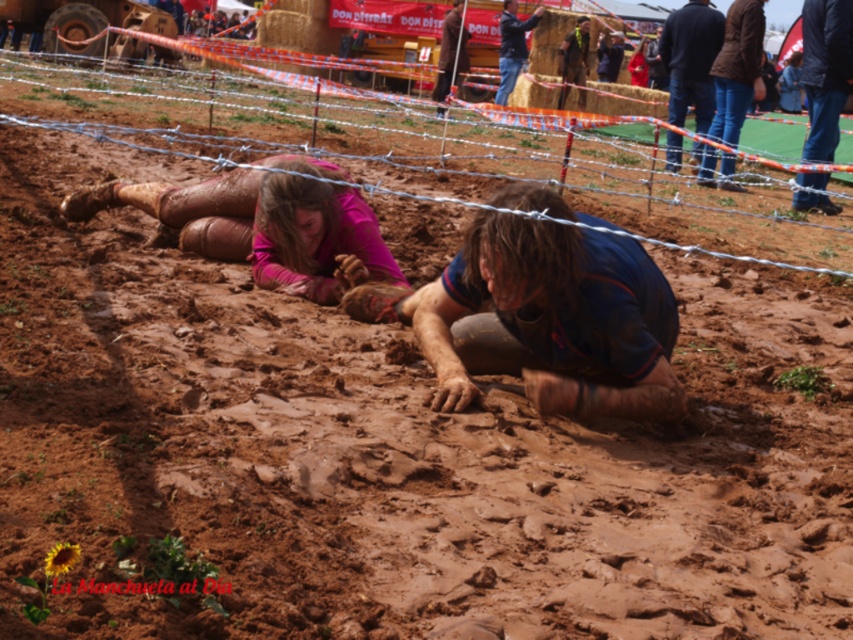
Question: Which point is farther from the camera taking this photo?

Choices:
 (A) (453, 54)
 (B) (761, 218)
 (C) (520, 54)

Answer: (C)

Question: Considering the relative positions of pink matte/skinny pants at center and dark blue shirt at upper center in the image provided, where is pink matte/skinny pants at center located with respect to dark blue shirt at upper center?

Choices:
 (A) below
 (B) above

Answer: (A)

Question: Can you confirm if dark blue shirt at upper center is thinner than brown leather jacket at upper center?

Choices:
 (A) yes
 (B) no

Answer: (B)

Question: Which point is closer to the camera taking this photo?

Choices:
 (A) (347, 104)
 (B) (662, 49)

Answer: (B)

Question: Which point is closer to the camera?

Choices:
 (A) pink matte/skinny pants at center
 (B) dark blue shirt at upper center
 (C) brown leather jacket at upper center
 (D) dark blue shirt at upper right

Answer: (A)

Question: Does dark blue shirt at upper right have a larger size compared to brown leather jacket at upper center?

Choices:
 (A) yes
 (B) no

Answer: (A)